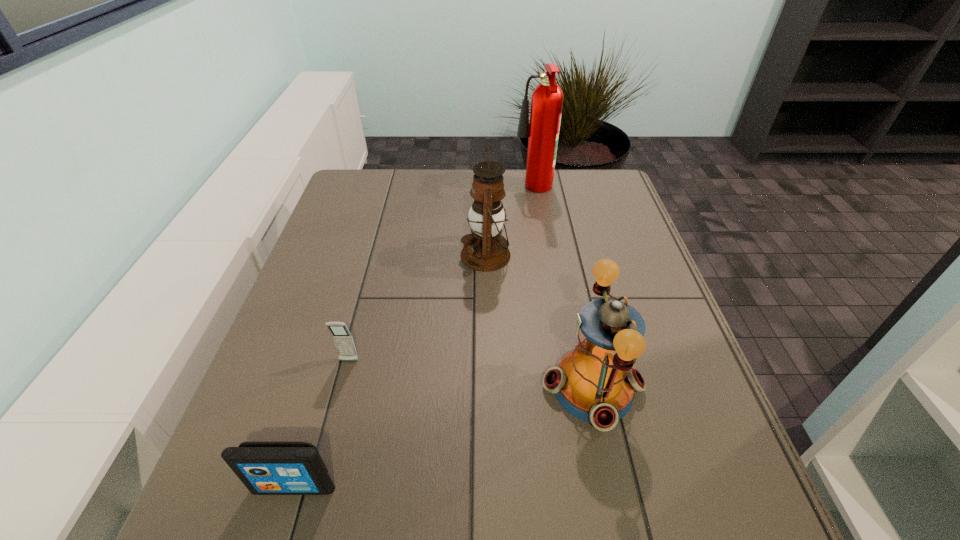
What are the coordinates of `object at the near edge` in the screenshot? It's located at (266, 468).

At what (x,y) coordinates should I click in order to perform the action: click on cellular telephone that is at the left edge. Please return your answer as a coordinate pair (x, y). This screenshot has height=540, width=960. Looking at the image, I should click on (342, 337).

Find the location of a particular element. The height and width of the screenshot is (540, 960). iPod that is positioned at the left edge is located at coordinates (266, 468).

Locate an element on the screen. object located at the right edge is located at coordinates (595, 383).

Locate an element on the screen. This screenshot has height=540, width=960. object at the near left corner is located at coordinates (266, 468).

In the image, there is a desktop. Where is `vacant area at the far edge`? The height and width of the screenshot is (540, 960). vacant area at the far edge is located at coordinates (523, 173).

At what (x,y) coordinates should I click in order to perform the action: click on free space at the near edge of the desktop. Please return your answer as a coordinate pair (x, y). This screenshot has width=960, height=540. Looking at the image, I should click on (436, 527).

Locate an element on the screen. The width and height of the screenshot is (960, 540). blank space at the left edge of the desktop is located at coordinates (337, 259).

Locate an element on the screen. vacant area at the right edge is located at coordinates (629, 264).

I want to click on free point at the far left corner, so click(345, 179).